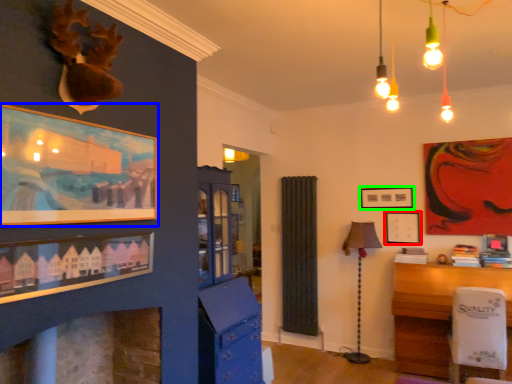
Question: Considering the real-world distances, which object is farthest from picture frame (highlighted by a red box)? picture frame (highlighted by a blue box) or picture frame (highlighted by a green box)?

Choices:
 (A) picture frame
 (B) picture frame

Answer: (A)